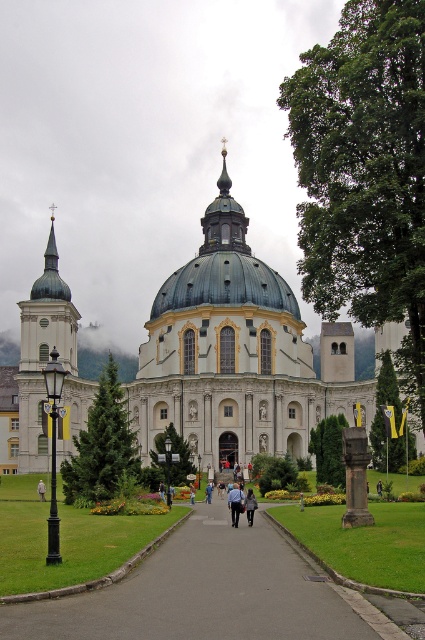
You are standing at the entrance of the white marble church at center and want to walk to the smooth asphalt path at center. Which direction should you face to move towards it?

Since the white marble church at center is further to the viewer than the smooth asphalt path at center, you should face away from the church towards the path to move towards it.

You are standing at the point with coordinates 0.5, 0.5 in the image. Which direction should you move to reach the white marble church at center?

Since the white marble church at center is located at point (237, 353), you should move northeast to reach it from your current position at (212, 320).

You are standing at point A located at coordinates [237,353]. What structure are you directly in front of?

The white marble church at center is located at point [237,353], so you are directly in front of the white marble church at center.